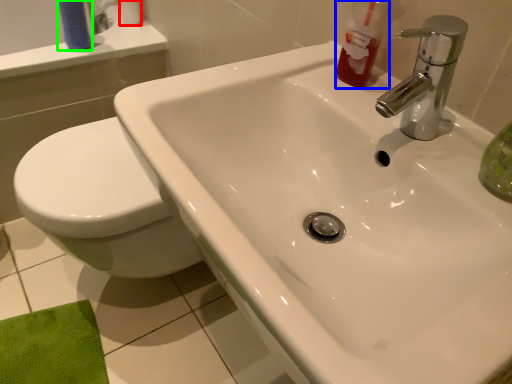
Question: Estimate the real-world distances between objects in this image. Which object is farther from toilet paper (highlighted by a red box), cleaning product (highlighted by a blue box) or toiletry (highlighted by a green box)?

Choices:
 (A) cleaning product
 (B) toiletry

Answer: (A)